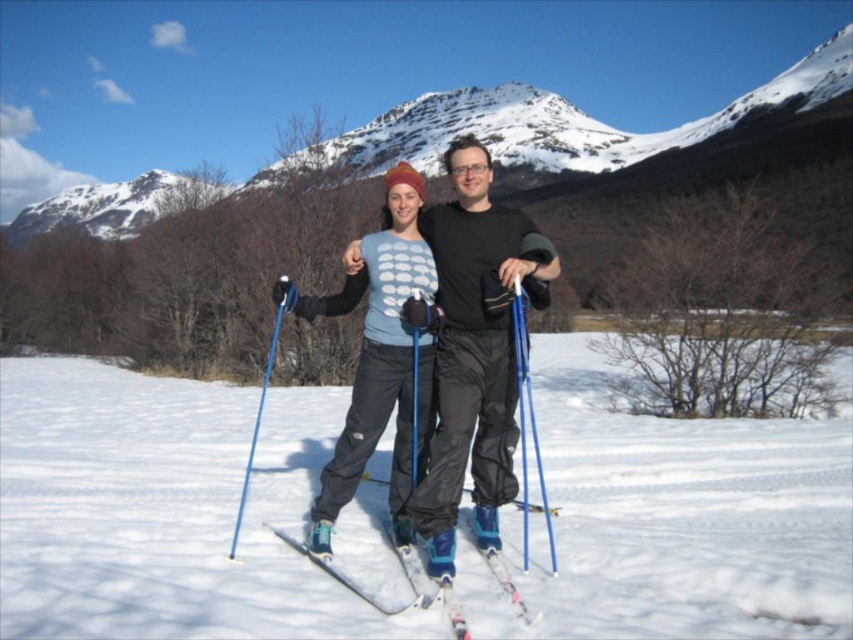
Question: Does blue plastic ski pole at center appear over white matte ski at center?

Choices:
 (A) yes
 (B) no

Answer: (A)

Question: Among these objects, which one is nearest to the camera?

Choices:
 (A) matte blue ski pole at center
 (B) blue plastic ski pole at center
 (C) white matte ski at center

Answer: (C)

Question: Which object is positioned closest to the white matte ski at center?

Choices:
 (A) matte blue ski at center
 (B) matte blue ski pole at center
 (C) blue plastic ski pole at center

Answer: (A)

Question: In this image, where is matte blue ski pole at center located relative to matte blue ski at center?

Choices:
 (A) below
 (B) above

Answer: (B)

Question: Which is nearer to the blue metallic ski pole at left?

Choices:
 (A) white matte ski at center
 (B) blue plastic ski pole at center
 (C) matte blue ski pole at center
 (D) white powder snow at center

Answer: (A)

Question: Is white powder snow at center positioned behind blue plastic ski pole at center?

Choices:
 (A) no
 (B) yes

Answer: (A)